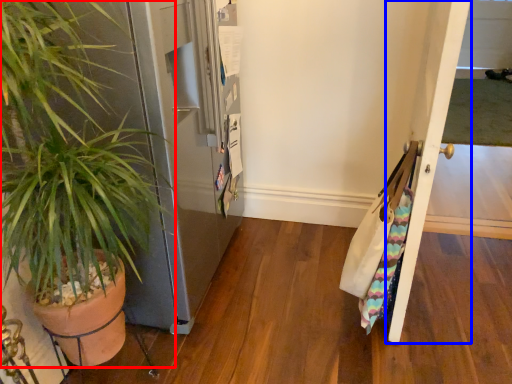
Question: Which point is closer to the camera, houseplant (highlighted by a red box) or door (highlighted by a blue box)?

Choices:
 (A) houseplant
 (B) door

Answer: (A)